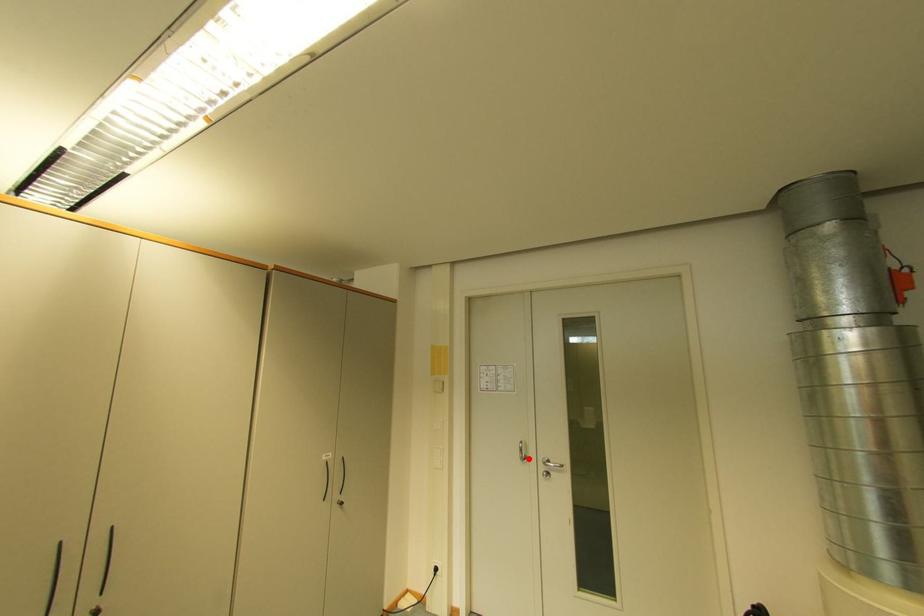
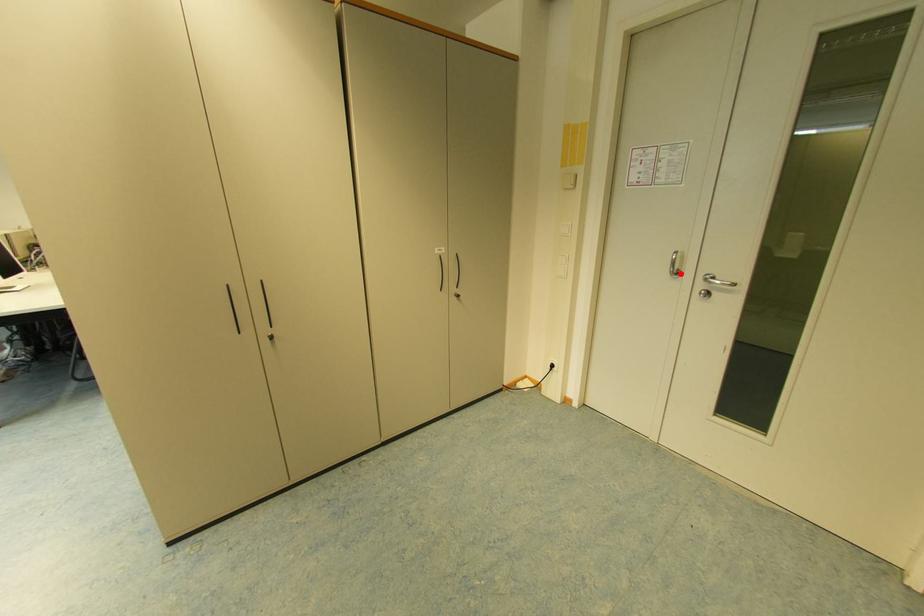
I am providing you with two images of the same scene from different viewpoints. A red point is marked on the first image and another point is marked on the second image. Does the point marked in image1 correspond to the same location as the one in image2?

Yes